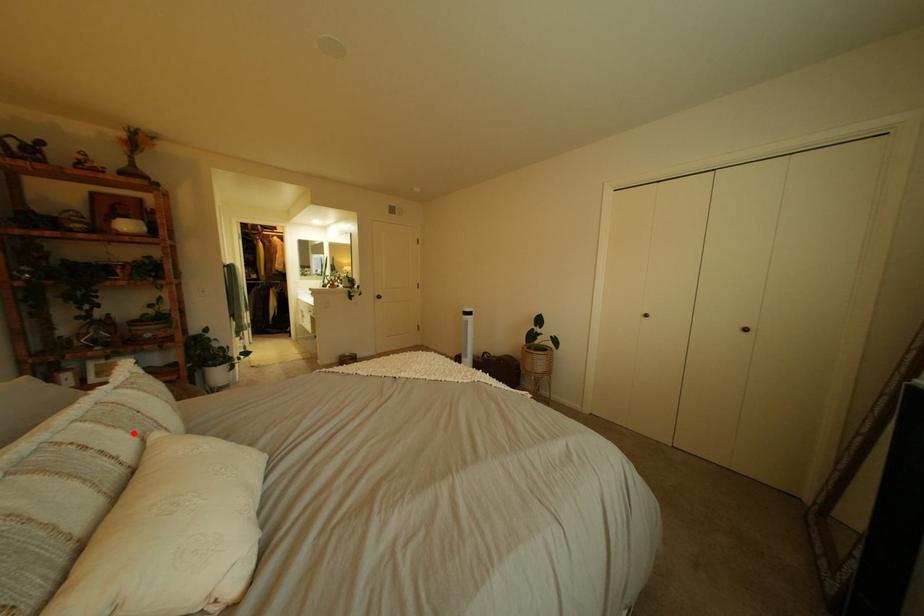
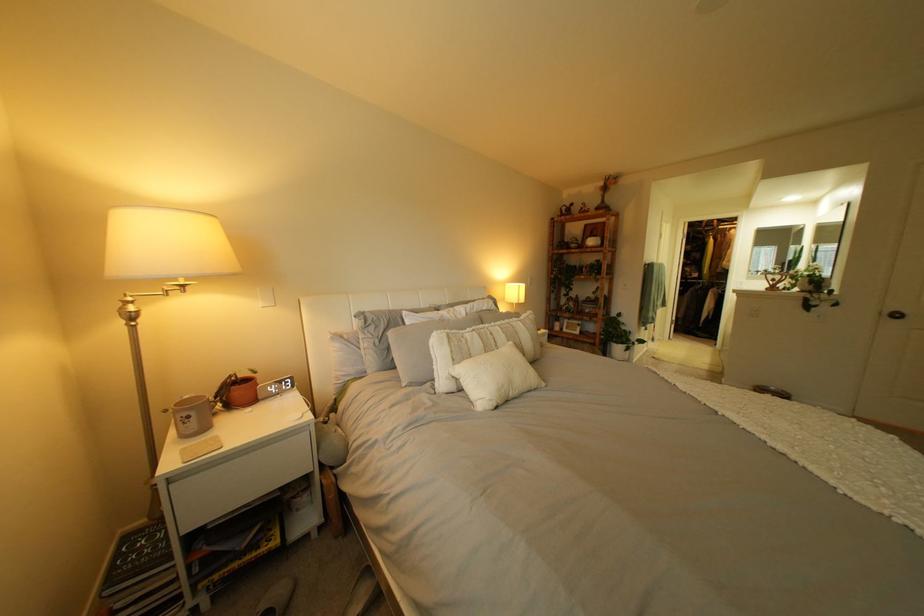
Where in the second image is the point corresponding to the highlighted location from the first image?

(518, 337)